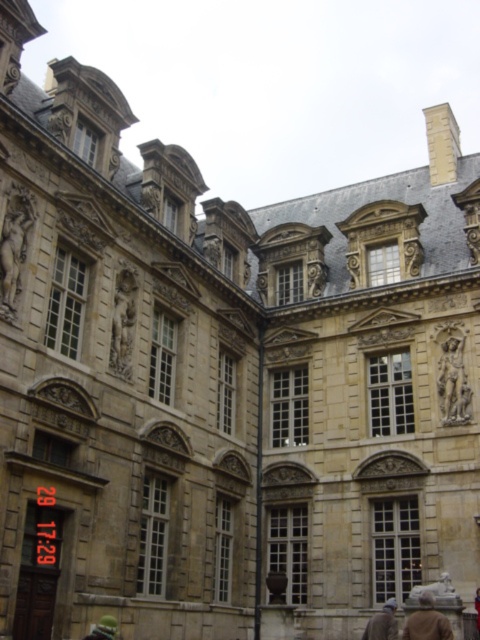
You are an architect examining the facade of this historic building. You notice two stone statues, the stone statue at left and the stone statue at center. Which one is positioned further to the left side of the building?

The stone statue at left is positioned further to the left side of the building compared to the stone statue at center, as it is located to the left of it.

You are an architect planning to install a new lighting system in the grand historic building. You need to place a spotlight between the polished bronze statue at center and the red fabric coat at center. What is the minimum distance the spotlight should be placed from each object to ensure it is equidistant from both?

The minimum distance the spotlight should be placed from each object to ensure it is equidistant from both is half of 28.64 meters, which is 14.32 meters. This places the spotlight exactly halfway between the polished bronze statue at center and the red fabric coat at center.

You are an art conservator assessing the placement of the polished bronze statue at center and the red fabric coat at center in the historic building. Considering their sizes, which object would require more space for proper conservation and why?

The polished bronze statue at center requires more space for proper conservation because it is bigger than the red fabric coat at center.